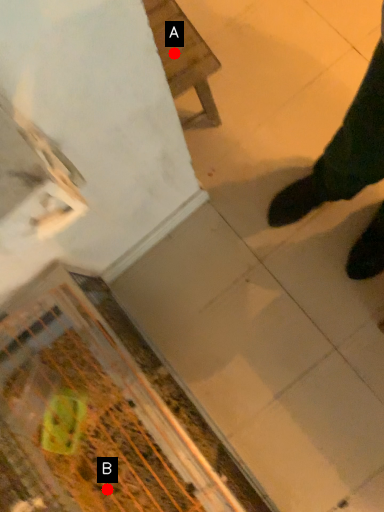
Question: Two points are circled on the image, labeled by A and B beside each circle. Among these points, which one is farthest from the camera?

Choices:
 (A) A is further
 (B) B is further

Answer: (A)